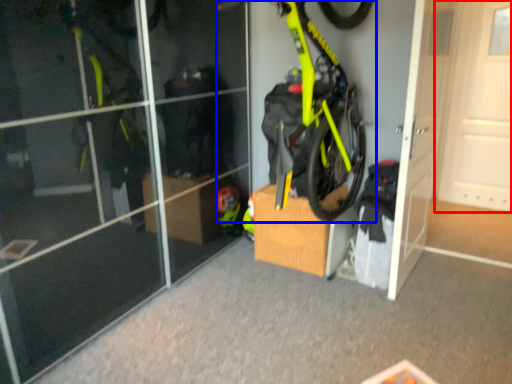
Question: Which point is closer to the camera, door (highlighted by a red box) or bicycle (highlighted by a blue box)?

Choices:
 (A) door
 (B) bicycle

Answer: (B)